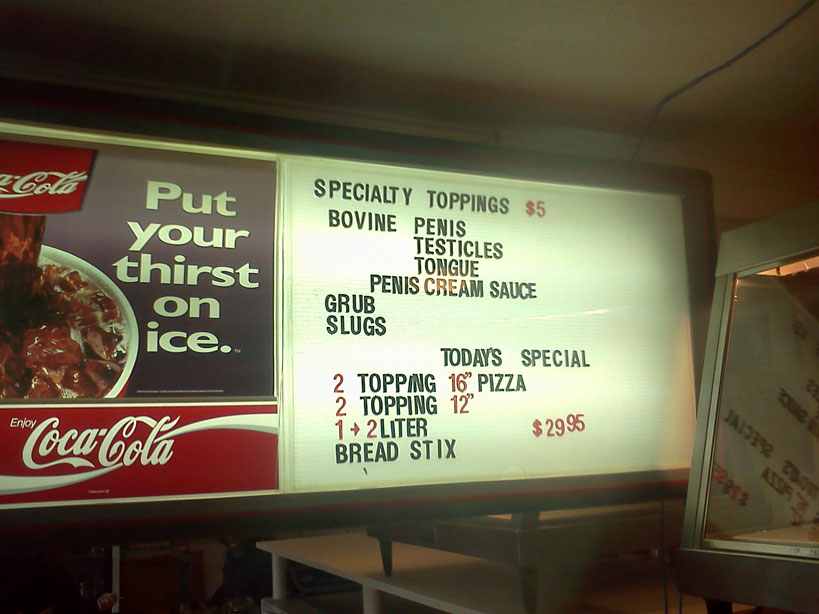
Find the location of a particular element. food warmer is located at coordinates (784, 535).